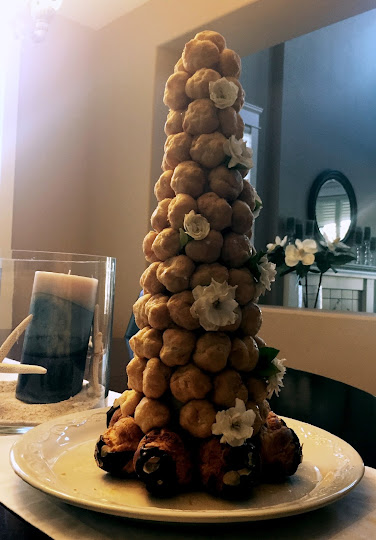
The image size is (376, 540). In order to click on candle wick in this screenshot , I will do `click(68, 271)`.